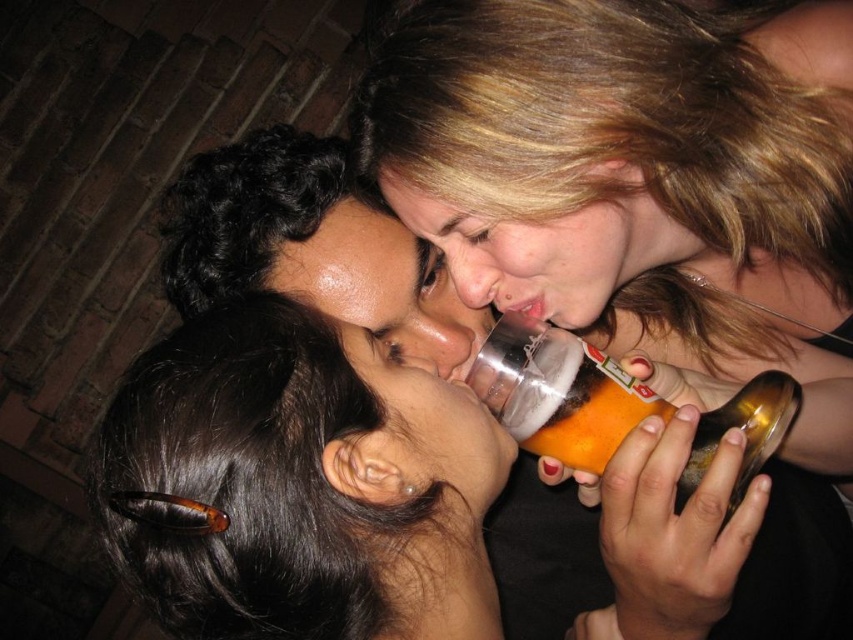
Who is taller, matte plastic bottle at center or translucent plastic bottle at center?

matte plastic bottle at center is taller.

Does matte plastic bottle at center have a larger size compared to translucent plastic bottle at center?

Correct, matte plastic bottle at center is larger in size than translucent plastic bottle at center.

Does point (476, 538) come behind point (749, 410)?

Yes.

Where is `matte plastic bottle at center`? This screenshot has height=640, width=853. matte plastic bottle at center is located at coordinates (299, 483).

Is translucent plastic cup at upper center above matte plastic bottle at center?

A: Correct, translucent plastic cup at upper center is located above matte plastic bottle at center.

Is translucent plastic cup at upper center to the right of matte plastic bottle at center from the viewer's perspective?

Indeed, translucent plastic cup at upper center is positioned on the right side of matte plastic bottle at center.

Who is more distant from viewer, (485, 266) or (337, 408)?

The point (485, 266) is behind.

Where is `translucent plastic cup at upper center`? translucent plastic cup at upper center is located at coordinates (625, 161).

Is translucent plastic cup at upper center wider than translucent plastic bottle at center?

Yes.

Between point (845, 540) and point (767, 456), which one is positioned behind?

Point (845, 540)

Does point (642, 227) lie behind point (688, 486)?

Yes.

Where is `translucent plastic cup at upper center`? Image resolution: width=853 pixels, height=640 pixels. translucent plastic cup at upper center is located at coordinates click(x=625, y=161).